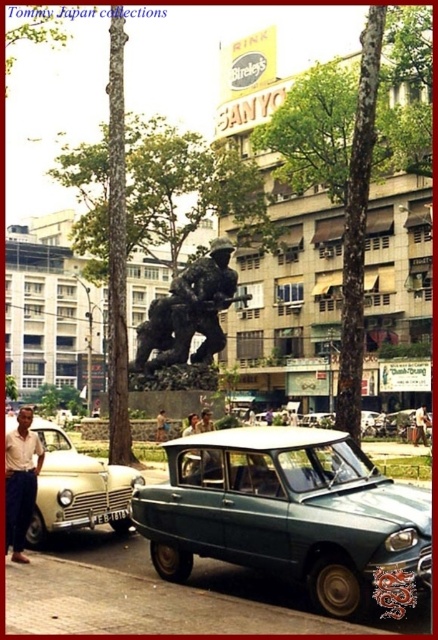
Question: Is the position of teal matte sedan at center more distant than that of light beige shirt at lower left?

Choices:
 (A) yes
 (B) no

Answer: (B)

Question: Which point appears closest to the camera in this image?

Choices:
 (A) (264, 246)
 (B) (211, 324)

Answer: (B)

Question: Among these points, which one is nearest to the camera?

Choices:
 (A) (424, 424)
 (B) (94, 154)
 (C) (102, 516)

Answer: (C)

Question: Which point is farther to the camera?

Choices:
 (A) (169, 442)
 (B) (413, 440)
 (C) (21, 467)

Answer: (B)

Question: Where is green leafy tree at center located in relation to light brown leather jacket at center in the image?

Choices:
 (A) left
 (B) right

Answer: (A)

Question: Is matte white car at left below green plastic license plate at center?

Choices:
 (A) yes
 (B) no

Answer: (B)